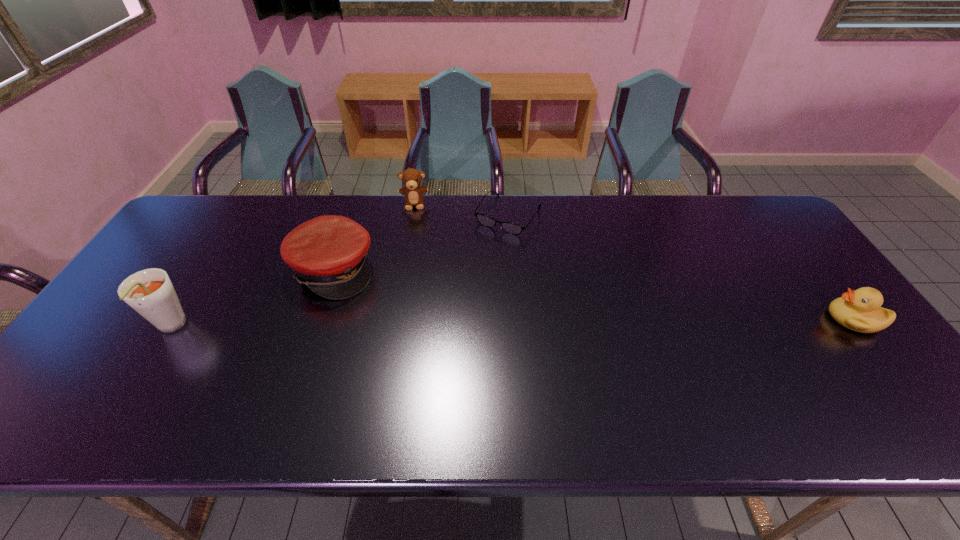
Image resolution: width=960 pixels, height=540 pixels. Find the location of `free space between the teddy bear and the fourth object from left to right`. free space between the teddy bear and the fourth object from left to right is located at coordinates (461, 210).

The height and width of the screenshot is (540, 960). What are the coordinates of `empty location between the cap and the tallest object` in the screenshot? It's located at [252, 299].

This screenshot has height=540, width=960. I want to click on free spot between the duckling and the spectacles, so click(x=681, y=267).

Locate an element on the screen. The height and width of the screenshot is (540, 960). empty space between the shortest object and the duckling is located at coordinates (681, 267).

You are a GUI agent. You are given a task and a screenshot of the screen. Output one action in this format:
    pyautogui.click(x=<x>, y=<y>)
    Task: Click on the unoccupied position between the duckling and the teddy bear
    The height and width of the screenshot is (540, 960).
    Given the screenshot: What is the action you would take?
    (x=635, y=261)

The width and height of the screenshot is (960, 540). In order to click on free space that is in between the rightmost object and the leftmost object in this screenshot , I will do `click(512, 323)`.

This screenshot has height=540, width=960. Find the location of `free point between the third nearest object and the rightmost object`. free point between the third nearest object and the rightmost object is located at coordinates (593, 294).

This screenshot has width=960, height=540. I want to click on vacant area between the third nearest object and the rightmost object, so click(593, 294).

Identify the location of object identified as the second closest to the rightmost object. (411, 178).

The height and width of the screenshot is (540, 960). Identify the location of object that stands as the third closest to the teddy bear. (149, 292).